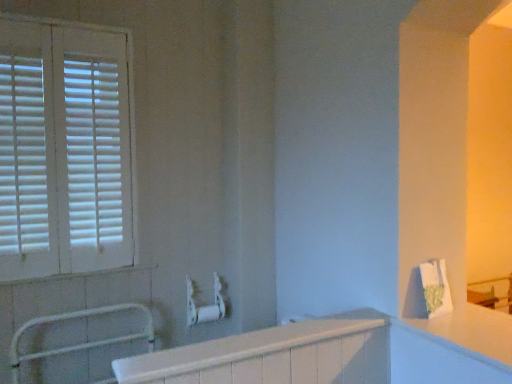
The image size is (512, 384). Describe the element at coordinates (470, 333) in the screenshot. I see `white glossy countertop at right` at that location.

Find the location of a particular element. This screenshot has height=384, width=512. white glossy bathtub at center is located at coordinates (274, 356).

Measure the distance between white wooden blinds at left and camera.

A distance of 5.28 feet exists between white wooden blinds at left and camera.

Identify the location of white matte metal balustrade at lower left. The image size is (512, 384). (78, 344).

Describe the element at coordinates (78, 344) in the screenshot. I see `white matte metal balustrade at lower left` at that location.

The height and width of the screenshot is (384, 512). Identify the location of white plastic towel bar at center. (205, 305).

Between white glossy countertop at right and white matte metal balustrade at lower left, which one has larger size?

With larger size is white matte metal balustrade at lower left.

From a real-world perspective, relative to white matte metal balustrade at lower left, is white glossy countertop at right vertically above or below?

Clearly, from a real-world perspective, white glossy countertop at right is above white matte metal balustrade at lower left.

Considering the relative sizes of white glossy countertop at right and white matte metal balustrade at lower left in the image provided, is white glossy countertop at right shorter than white matte metal balustrade at lower left?

Yes.

This screenshot has width=512, height=384. Identify the location of counter top in front of the white matte metal balustrade at lower left. (470, 333).

Could you tell me if white matte metal balustrade at lower left is facing white glossy bathtub at center?

Yes, white matte metal balustrade at lower left faces towards white glossy bathtub at center.

How many degrees apart are the facing directions of white matte metal balustrade at lower left and white glossy bathtub at center?

There is a 0.0299-degree angle between the facing directions of white matte metal balustrade at lower left and white glossy bathtub at center.

Is white matte metal balustrade at lower left positioned in front of white glossy bathtub at center?

No, white matte metal balustrade at lower left is further to the viewer.

Considering the sizes of white matte metal balustrade at lower left and white glossy bathtub at center in the image, is white matte metal balustrade at lower left taller or shorter than white glossy bathtub at center?

In the image, white matte metal balustrade at lower left appears to be taller than white glossy bathtub at center.

Is white wooden blinds at left taller than white plastic towel bar at center?

Correct, white wooden blinds at left is much taller as white plastic towel bar at center.

Which point is more forward, (53,220) or (225,303)?

The point (53,220) is closer to the camera.

Does white wooden blinds at left come in front of white plastic towel bar at center?

Yes, white wooden blinds at left is in front of white plastic towel bar at center.

Consider the image. From the image's perspective, is white plastic towel bar at center located beneath white wooden blinds at left?

Correct, white plastic towel bar at center appears lower than white wooden blinds at left in the image.

Can white wooden blinds at left be found inside white plastic towel bar at center?

No, white wooden blinds at left is located outside of white plastic towel bar at center.

Which object is closer to the camera taking this photo, white plastic towel bar at center or white wooden blinds at left?

Positioned in front is white wooden blinds at left.

How different are the orientations of white plastic towel bar at center and white wooden blinds at left in degrees?

There is a 0.132-degree angle between the facing directions of white plastic towel bar at center and white wooden blinds at left.

From a real-world perspective, is white glossy countertop at right positioned above or below white wooden blinds at left?

Clearly, from a real-world perspective, white glossy countertop at right is below white wooden blinds at left.

Considering the relative positions of white glossy countertop at right and white wooden blinds at left in the image provided, is white glossy countertop at right to the left of white wooden blinds at left from the viewer's perspective?

In fact, white glossy countertop at right is to the right of white wooden blinds at left.

Is white glossy countertop at right wider than white wooden blinds at left?

Yes, white glossy countertop at right is wider than white wooden blinds at left.

From the image's perspective, is white wooden blinds at left located beneath white glossy countertop at right?

No, from the image's perspective, white wooden blinds at left is not beneath white glossy countertop at right.

From a real-world perspective, is white wooden blinds at left beneath white glossy countertop at right?

No.

Are white wooden blinds at left and white glossy countertop at right located far from each other?

Absolutely, white wooden blinds at left is distant from white glossy countertop at right.

Considering the positions of point (7, 137) and point (511, 350), is point (7, 137) closer or farther from the camera than point (511, 350)?

Point (7, 137) appears to be farther away from the viewer than point (511, 350).

Considering the sizes of white plastic towel bar at center and white glossy countertop at right in the image, is white plastic towel bar at center wider or thinner than white glossy countertop at right?

Clearly, white plastic towel bar at center has less width compared to white glossy countertop at right.

Which is closer, (219,280) or (468,346)?

Point (219,280) is farther from the camera than point (468,346).

Are white plastic towel bar at center and white glossy countertop at right making contact?

They are not placed beside each other.

From a real-world perspective, does white plastic towel bar at center stand above white glossy countertop at right?

No, from a real-world perspective, white plastic towel bar at center is not above white glossy countertop at right.

Where is `balustrade beneath the white glossy countertop at right (from a real-world perspective)`? This screenshot has height=384, width=512. balustrade beneath the white glossy countertop at right (from a real-world perspective) is located at coordinates (78, 344).

Locate an element on the screen. The image size is (512, 384). bath above the white matte metal balustrade at lower left (from the image's perspective) is located at coordinates (274, 356).

From the picture: Based on their spatial positions, is white plastic towel bar at center or white glossy countertop at right closer to white matte metal balustrade at lower left?

The object closer to white matte metal balustrade at lower left is white plastic towel bar at center.

Considering their positions, is white wooden blinds at left positioned closer to white glossy bathtub at center than white matte metal balustrade at lower left?

white matte metal balustrade at lower left.

When comparing their distances from white plastic towel bar at center, does white glossy bathtub at center or white wooden blinds at left seem further?

white glossy bathtub at center lies further to white plastic towel bar at center than the other object.

Which object lies further to the anchor point white glossy bathtub at center, white wooden blinds at left or white plastic towel bar at center?

The object further to white glossy bathtub at center is white wooden blinds at left.

When comparing their distances from white matte metal balustrade at lower left, does white glossy countertop at right or white wooden blinds at left seem closer?

Based on the image, white wooden blinds at left appears to be nearer to white matte metal balustrade at lower left.

When comparing their distances from white plastic towel bar at center, does white wooden blinds at left or white glossy bathtub at center seem further?

The object further to white plastic towel bar at center is white glossy bathtub at center.

Based on the photo, considering their positions, is white plastic towel bar at center positioned closer to white matte metal balustrade at lower left than white glossy bathtub at center?

Among the two, white plastic towel bar at center is located nearer to white matte metal balustrade at lower left.

Which object lies nearer to the anchor point white glossy bathtub at center, white plastic towel bar at center or white wooden blinds at left?

Among the two, white plastic towel bar at center is located nearer to white glossy bathtub at center.

Find the location of a particular element. Image resolution: width=512 pixels, height=384 pixels. towel bar between white wooden blinds at left and white glossy countertop at right in the horizontal direction is located at coordinates (205, 305).

Identify the location of towel bar situated between white matte metal balustrade at lower left and white glossy countertop at right from left to right. This screenshot has height=384, width=512. (205, 305).

At what (x,y) coordinates should I click in order to perform the action: click on balustrade located between white wooden blinds at left and white glossy bathtub at center in the left-right direction. Please return your answer as a coordinate pair (x, y). The height and width of the screenshot is (384, 512). Looking at the image, I should click on (78, 344).

The image size is (512, 384). In order to click on towel bar between white wooden blinds at left and white matte metal balustrade at lower left from top to bottom in this screenshot , I will do `click(205, 305)`.